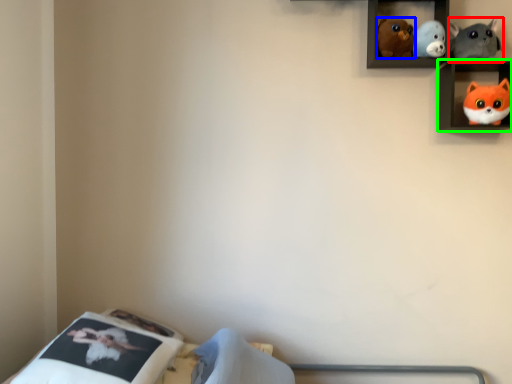
Question: Based on their relative distances, which object is nearer to toy (highlighted by a red box)? Choose from toy (highlighted by a blue box) and shelf (highlighted by a green box).

Choices:
 (A) toy
 (B) shelf

Answer: (B)